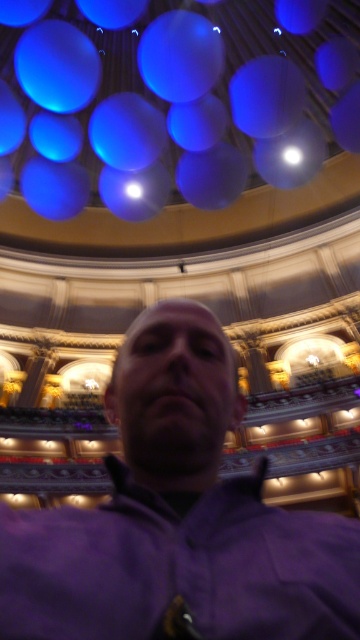
You are standing in the grand venue and want to place a small decorative item on the purple matte jacket at center. Considering the jacket is at coordinates point 0.811, 0.494, where exactly should you place the item to ensure it stays centered?

The purple matte jacket at center is already positioned at point (177, 518), so placing the decorative item directly at those coordinates will keep it centered on the jacket.

You are a photographer trying to capture a detailed closeup of the purple matte jacket at center. Based on the scene description, can you determine if you need to adjust your camera focus to get a clear image?

The purple matte jacket at center is 20.32 meters away from camera, so you need to adjust your camera focus to capture a clear closeup image since it is too far away for a standard focus setting.

You are planning to take a photo in this venue and want to ensure both the purple matte jacket at center and the blue glossy balloon at upper center are visible. Given their sizes, which object might require you to adjust your camera angle to avoid cropping it out?

The blue glossy balloon at upper center has a greater width than the purple matte jacket at center, so it might require adjusting the camera angle to ensure it is fully visible in the photo.